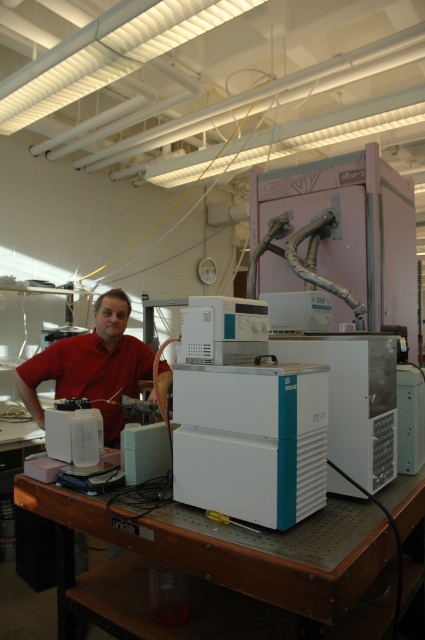
From the picture: Between matte red shirt at center and white plastic workbench at lower center, which one has more height?

Standing taller between the two is matte red shirt at center.

Consider the image. Does matte red shirt at center come in front of white plastic workbench at lower center?

No, it is not.

Who is more distant from viewer, [116,337] or [36,486]?

The point [116,337] is behind.

Locate an element on the screen. The image size is (425, 640). matte red shirt at center is located at coordinates (91, 365).

Between white plastic equipment at center and white plastic workbench at lower center, which one is positioned higher?

white plastic equipment at center is above.

This screenshot has height=640, width=425. I want to click on white plastic equipment at center, so click(246, 419).

Between point (300, 404) and point (107, 323), which one is positioned in front?

Point (300, 404) is in front.

Between point (255, 310) and point (59, 378), which one is positioned in front?

Point (255, 310) is more forward.

Identify the location of white plastic equipment at center. (246, 419).